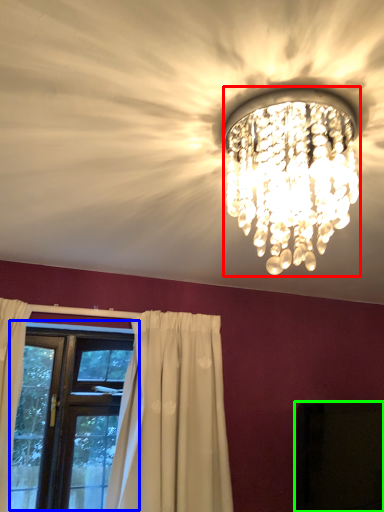
Question: Which object is the closest to the lamp (highlighted by a red box)? Choose among these: window (highlighted by a blue box) or dark (highlighted by a green box).

Choices:
 (A) window
 (B) dark

Answer: (B)